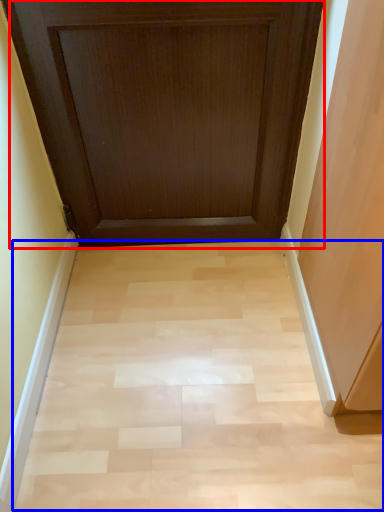
Question: Among these objects, which one is farthest to the camera, door (highlighted by a red box) or plain (highlighted by a blue box)?

Choices:
 (A) door
 (B) plain

Answer: (B)